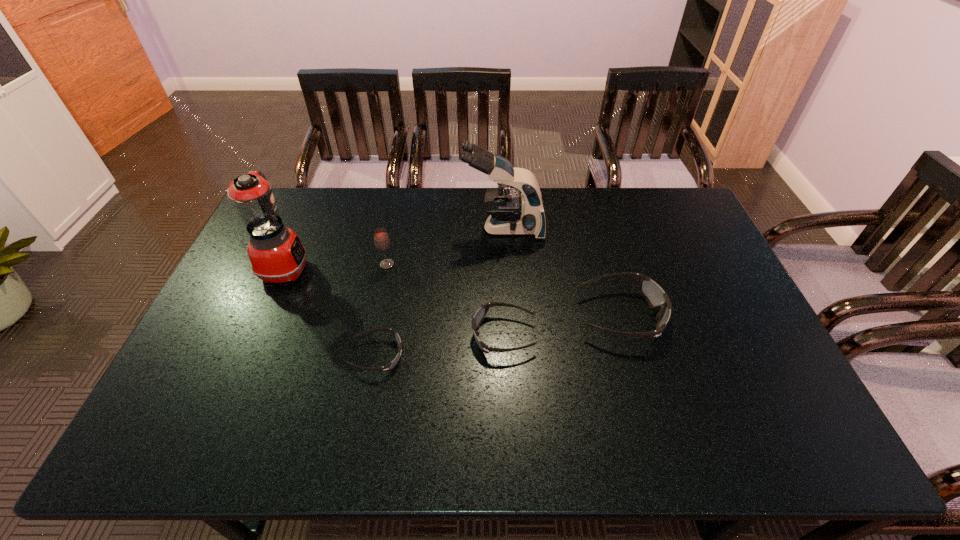
Please point a spot on the right to add another sunglasses. Please provide its 2D coordinates. Your answer should be formatted as a tuple, i.e. [(x, y)], where the tuple contains the x and y coordinates of a point satisfying the conditions above.

[(730, 298)]